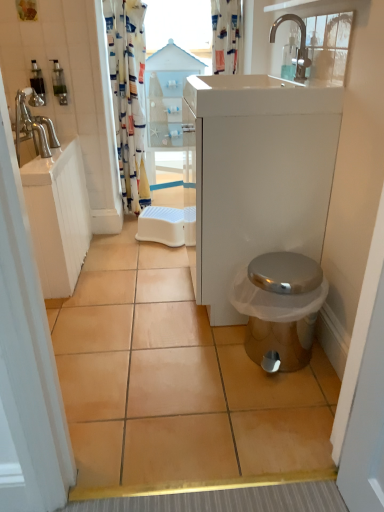
Question: Is translucent plastic soap dispenser at upper left, positioned as the second toiletry in right-to-left order, next to beige ceramic tile at center?

Choices:
 (A) yes
 (B) no

Answer: (B)

Question: Can you confirm if translucent plastic soap dispenser at upper left, acting as the first toiletry starting from the left, is thinner than beige ceramic tile at center?

Choices:
 (A) yes
 (B) no

Answer: (A)

Question: Does translucent plastic soap dispenser at upper left, acting as the first toiletry starting from the left, have a larger size compared to beige ceramic tile at center?

Choices:
 (A) yes
 (B) no

Answer: (B)

Question: Is translucent plastic soap dispenser at upper left, acting as the first toiletry starting from the left, further to camera compared to beige ceramic tile at center?

Choices:
 (A) yes
 (B) no

Answer: (A)

Question: Can you confirm if translucent plastic soap dispenser at upper left, positioned as the second toiletry in right-to-left order, is smaller than beige ceramic tile at center?

Choices:
 (A) no
 (B) yes

Answer: (B)

Question: From the image's perspective, does translucent plastic soap dispenser at upper left, acting as the first toiletry starting from the left, appear higher than beige ceramic tile at center?

Choices:
 (A) no
 (B) yes

Answer: (B)

Question: From the image's perspective, is transparent wood cabinet at center over transparent plastic window screen at upper center?

Choices:
 (A) no
 (B) yes

Answer: (A)

Question: Does transparent wood cabinet at center have a lesser height compared to transparent plastic window screen at upper center?

Choices:
 (A) no
 (B) yes

Answer: (A)

Question: Is transparent wood cabinet at center far away from transparent plastic window screen at upper center?

Choices:
 (A) no
 (B) yes

Answer: (A)

Question: Is transparent wood cabinet at center positioned before transparent plastic window screen at upper center?

Choices:
 (A) no
 (B) yes

Answer: (B)

Question: Is transparent wood cabinet at center to the right of transparent plastic window screen at upper center from the viewer's perspective?

Choices:
 (A) no
 (B) yes

Answer: (A)

Question: Is transparent wood cabinet at center to the left of transparent plastic window screen at upper center from the viewer's perspective?

Choices:
 (A) yes
 (B) no

Answer: (A)

Question: Is white glossy sink at upper center taller than printed fabric shower curtain at upper center, which is the 1th shower curtain in right-to-left order?

Choices:
 (A) no
 (B) yes

Answer: (A)